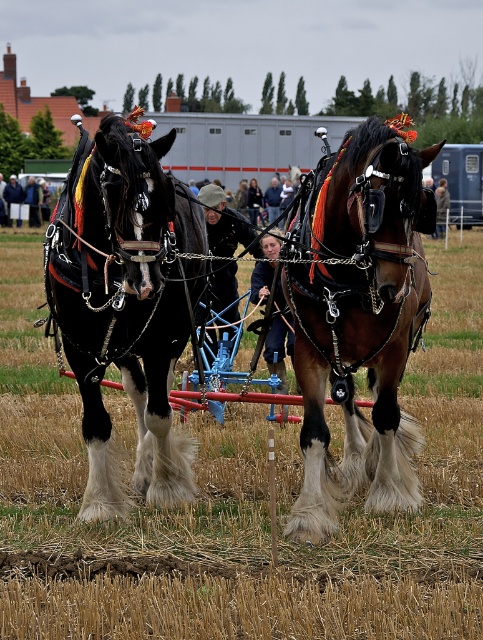
Question: Does brown glossy horse at center lie in front of dark blue fabric at center?

Choices:
 (A) no
 (B) yes

Answer: (B)

Question: Which object appears farthest from the camera in this image?

Choices:
 (A) black glossy horse at left
 (B) brown fluffy hay at center
 (C) smooth blue jeans at center
 (D) brown glossy horse at center

Answer: (C)

Question: Does black glossy horse at left have a greater width compared to dark brown leather jacket at center?

Choices:
 (A) no
 (B) yes

Answer: (B)

Question: Which of the following is the farthest from the observer?

Choices:
 (A) black glossy horse at left
 (B) dark blue fabric at center
 (C) smooth blue jeans at center

Answer: (C)

Question: Which object appears farthest from the camera in this image?

Choices:
 (A) dark blue fabric at center
 (B) smooth blue jeans at center

Answer: (B)

Question: Is brown glossy horse at center to the right of smooth blue jeans at center from the viewer's perspective?

Choices:
 (A) yes
 (B) no

Answer: (A)